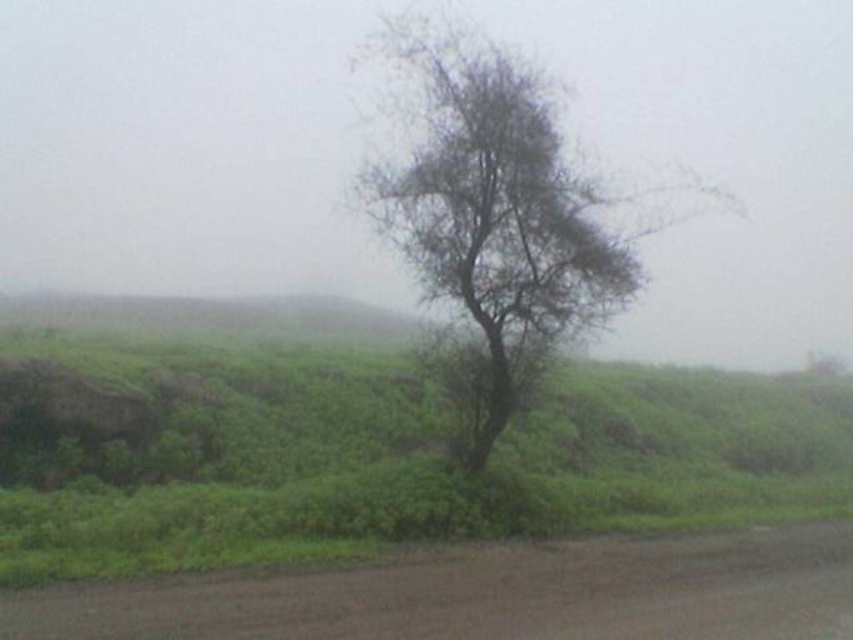
You are a hiker who wants to take a photo of the green leafy tree at center and the brown dirt track at lower center. Since the tree is blocking your view of the track, can you move to a position where you can see both objects clearly?

The green leafy tree at center is taller than the brown dirt track at lower center. Therefore, moving to a position behind the brown dirt track at lower center would allow you to see both the tree and the track simultaneously, as the tree is taller and would still be visible above the track.